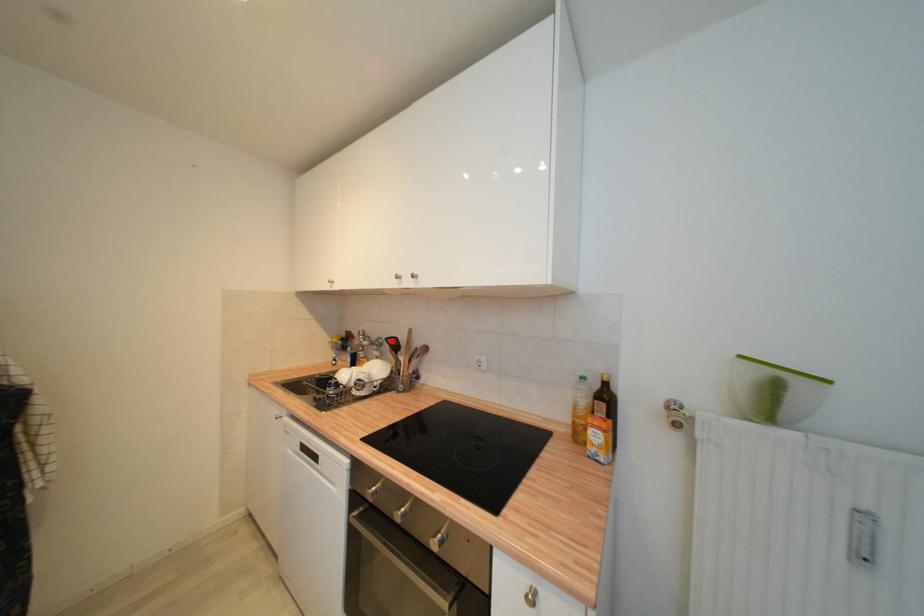
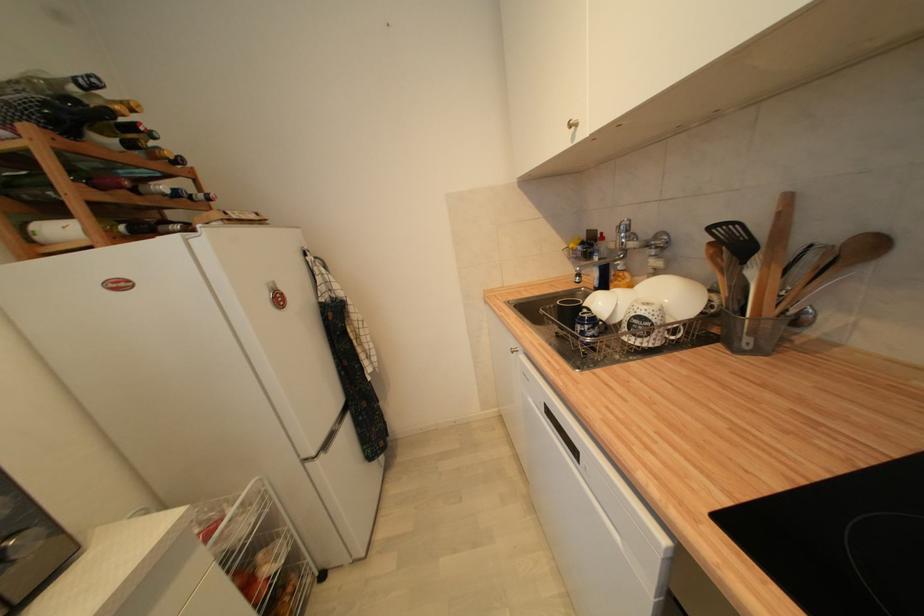
Locate, in the second image, the point that corresponds to the highlighted location in the first image.

(715, 230)